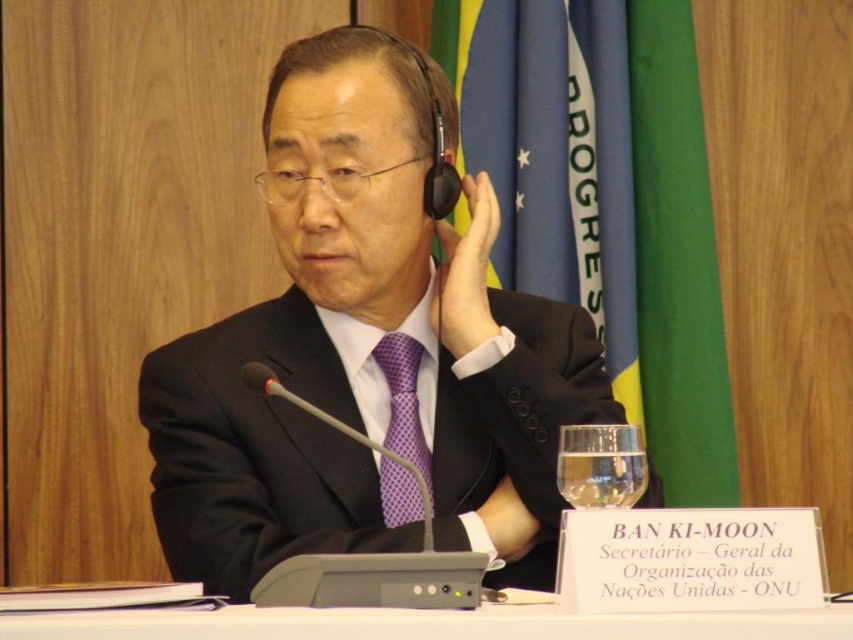
Who is positioned more to the left, white plastic table at center or purple dotted tie at center?

Positioned to the left is purple dotted tie at center.

Which is in front, point (735, 627) or point (407, 401)?

Positioned in front is point (735, 627).

Is point (757, 627) more distant than point (415, 374)?

No, (757, 627) is closer to viewer.

Locate an element on the screen. The image size is (853, 640). white plastic table at center is located at coordinates (430, 624).

Is point (424, 388) less distant than point (602, 465)?

No, it is behind (602, 465).

Is the position of black matte suit at center less distant than that of clear glass at lower right?

No.

Between point (332, 531) and point (633, 472), which one is positioned behind?

The point (332, 531) is more distant.

Locate an element on the screen. The height and width of the screenshot is (640, 853). black matte suit at center is located at coordinates (367, 346).

Is purple dotted tie at center behind clear glass at lower right?

That is True.

Can you confirm if purple dotted tie at center is positioned to the right of clear glass at lower right?

No, purple dotted tie at center is not to the right of clear glass at lower right.

Measure the distance between purple dotted tie at center and camera.

A distance of 1.39 meters exists between purple dotted tie at center and camera.

Locate an element on the screen. The height and width of the screenshot is (640, 853). purple dotted tie at center is located at coordinates (403, 400).